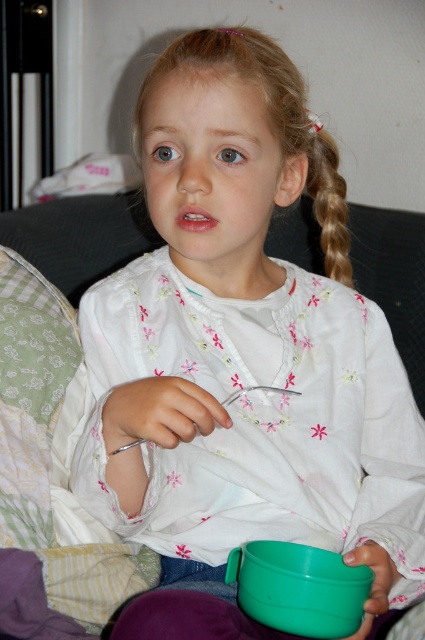
The user is designing a scene where the young girl needs to place her belongings in order of size. Given that she has a green plastic bowl at lower center and blonde hair at upper right, which item should she place first if she starts with the smaller one?

The green plastic bowl at lower center is smaller than the blonde hair at upper right, so she should place the green plastic bowl at lower center first.

You are a delivery robot that needs to place a package between the green plastic bowl at lower center and the blonde hair at upper right. The package is 18 inches long. Can you fit it between them?

The distance between the green plastic bowl at lower center and the blonde hair at upper right is 20.00 inches. Since the package is 18 inches long, it can fit between them with 2 inches of space remaining.

You are standing 30 inches away from the image. Can you reach the point at coordinates point (x=238, y=602)?

The point at coordinates point (x=238, y=602) is 27.40 inches from the viewer. Since you are standing 30 inches away, you are 2.6 inches too far to reach it.